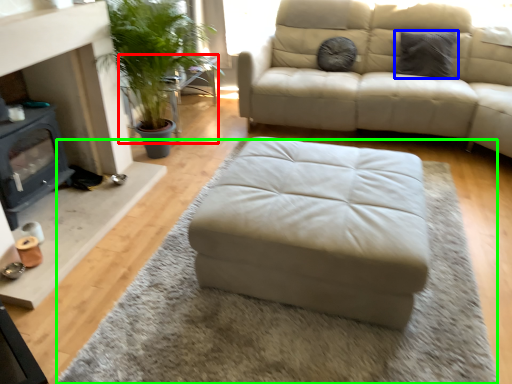
Question: Which object is positioned closest to table (highlighted by a red box)? Select from pillow (highlighted by a blue box) and mat (highlighted by a green box).

Choices:
 (A) pillow
 (B) mat

Answer: (A)